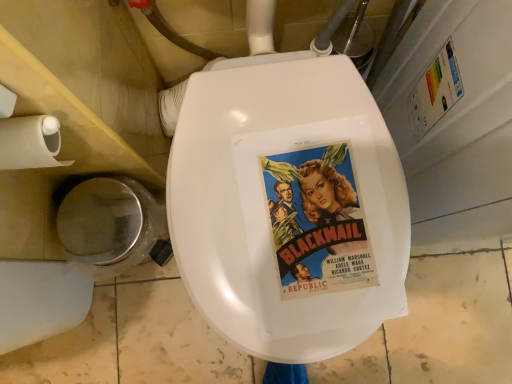
Describe the element at coordinates (112, 226) in the screenshot. The width and height of the screenshot is (512, 384). I see `shiny metallic trash can at lower left` at that location.

The height and width of the screenshot is (384, 512). What do you see at coordinates (30, 142) in the screenshot?
I see `beige paper towel at left` at bounding box center [30, 142].

This screenshot has height=384, width=512. In order to click on shiny metallic trash can at lower left in this screenshot , I will do `click(112, 226)`.

Is beige paper towel at left located outside vivid paper poster at center?

Yes, beige paper towel at left is not within vivid paper poster at center.

How far apart are beige paper towel at left and vivid paper poster at center?

13.83 inches.

From the image's perspective, is beige paper towel at left located above or below vivid paper poster at center?

From the image's perspective, beige paper towel at left appears above vivid paper poster at center.

Could you tell me if beige paper towel at left is turned towards vivid paper poster at center?

No, beige paper towel at left is not turned towards vivid paper poster at center.

Considering the points (71, 161) and (89, 246), which point is behind, point (71, 161) or point (89, 246)?

Point (89, 246)

Is beige paper towel at left facing away from shiny metallic trash can at lower left?

That's not correct — beige paper towel at left is not looking away from shiny metallic trash can at lower left.

Can you tell me how much beige paper towel at left and shiny metallic trash can at lower left differ in facing direction?

1.37 degrees.

Based on the photo, is beige paper towel at left situated inside shiny metallic trash can at lower left or outside?

The correct answer is: outside.

Is shiny metallic trash can at lower left facing away from beige paper towel at left?

No, shiny metallic trash can at lower left's orientation is not away from beige paper towel at left.

Relative to beige paper towel at left, is shiny metallic trash can at lower left in front or behind?

Clearly, shiny metallic trash can at lower left is behind beige paper towel at left.

What's the angular difference between shiny metallic trash can at lower left and beige paper towel at left's facing directions?

The facing directions of shiny metallic trash can at lower left and beige paper towel at left are 1.37 degrees apart.

From a real-world perspective, is shiny metallic trash can at lower left above or below beige paper towel at left?

shiny metallic trash can at lower left is below beige paper towel at left.

From a real-world perspective, is vivid paper poster at center positioned over beige paper towel at left based on gravity?

Actually, vivid paper poster at center is physically below beige paper towel at left in the real world.

From the image's perspective, relative to beige paper towel at left, is vivid paper poster at center above or below?

Clearly, from the image's perspective, vivid paper poster at center is below beige paper towel at left.

Is vivid paper poster at center behind beige paper towel at left?

Yes.

What's the angular difference between vivid paper poster at center and beige paper towel at left's facing directions?

The angle between the facing direction of vivid paper poster at center and the facing direction of beige paper towel at left is 4.77 degrees.

From the image's perspective, which one is positioned lower, vivid paper poster at center or shiny metallic trash can at lower left?

shiny metallic trash can at lower left.

Is vivid paper poster at center far from shiny metallic trash can at lower left?

No.

From a real-world perspective, which object rests below the other?

From a 3D spatial view, shiny metallic trash can at lower left is below.

Locate an element on the screen. The height and width of the screenshot is (384, 512). comic book character on the right of shiny metallic trash can at lower left is located at coordinates (317, 222).

Is shiny metallic trash can at lower left not near vivid paper poster at center?

No, shiny metallic trash can at lower left is in close proximity to vivid paper poster at center.

Does shiny metallic trash can at lower left have a lesser height compared to vivid paper poster at center?

No.

Considering the positions of objects shiny metallic trash can at lower left and vivid paper poster at center in the image provided, who is in front, shiny metallic trash can at lower left or vivid paper poster at center?

Positioned in front is vivid paper poster at center.

Which object is positioned more to the right, shiny metallic trash can at lower left or vivid paper poster at center?

vivid paper poster at center.

Identify the location of comic book character located on the right of beige paper towel at left. The height and width of the screenshot is (384, 512). pyautogui.click(x=317, y=222).

The image size is (512, 384). I want to click on toilet bowl lying on the left of beige paper towel at left, so click(112, 226).

Which object lies further to the anchor point vivid paper poster at center, beige paper towel at left or shiny metallic trash can at lower left?

shiny metallic trash can at lower left is further to vivid paper poster at center.

Estimate the real-world distances between objects in this image. Which object is closer to beige paper towel at left, vivid paper poster at center or shiny metallic trash can at lower left?

shiny metallic trash can at lower left is closer to beige paper towel at left.

Looking at the image, which one is located closer to vivid paper poster at center, shiny metallic trash can at lower left or beige paper towel at left?

beige paper towel at left lies closer to vivid paper poster at center than the other object.

From the image, which object appears to be farther from beige paper towel at left, shiny metallic trash can at lower left or vivid paper poster at center?

Based on the image, vivid paper poster at center appears to be further to beige paper towel at left.

Based on their spatial positions, is vivid paper poster at center or beige paper towel at left further from shiny metallic trash can at lower left?

vivid paper poster at center.

Based on their spatial positions, is beige paper towel at left or vivid paper poster at center closer to shiny metallic trash can at lower left?

beige paper towel at left is positioned closer to the anchor shiny metallic trash can at lower left.

The height and width of the screenshot is (384, 512). Identify the location of toilet paper between shiny metallic trash can at lower left and vivid paper poster at center. (30, 142).